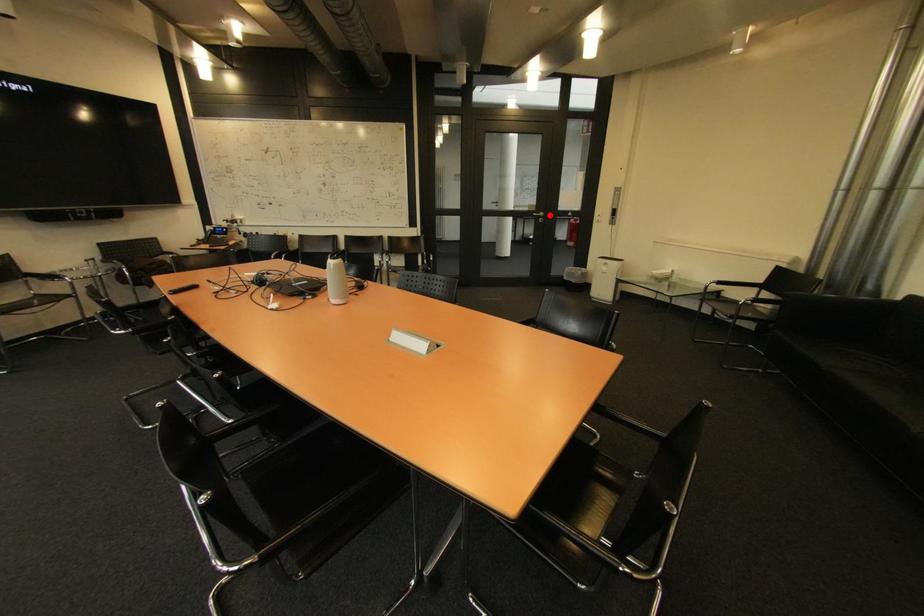
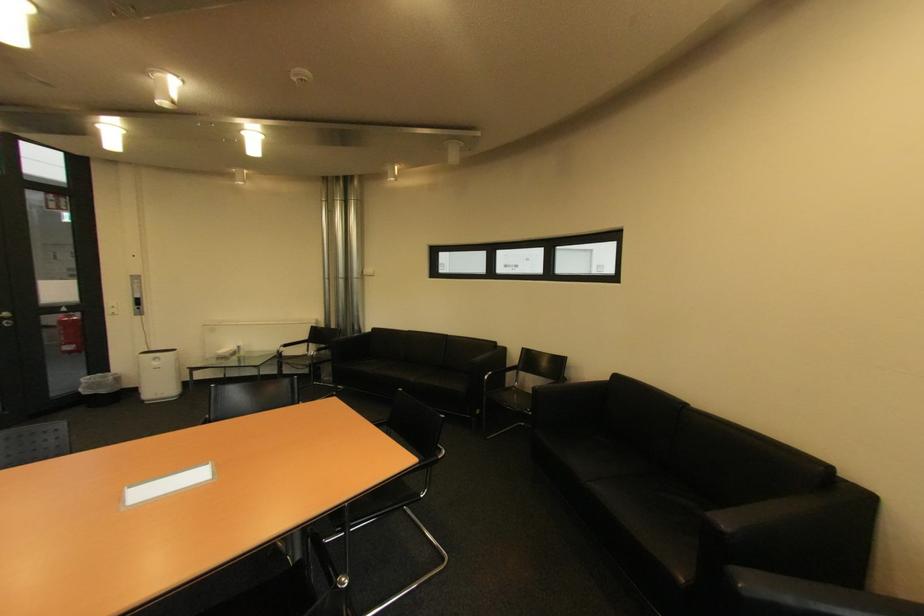
Question: I am providing you with two images of the same scene from different viewpoints. Image1 has a red point marked. In image2, the corresponding 3D location appears at what relative position? Reply with the corresponding letter.

Choices:
 (A) Closer
 (B) Farther

Answer: (B)